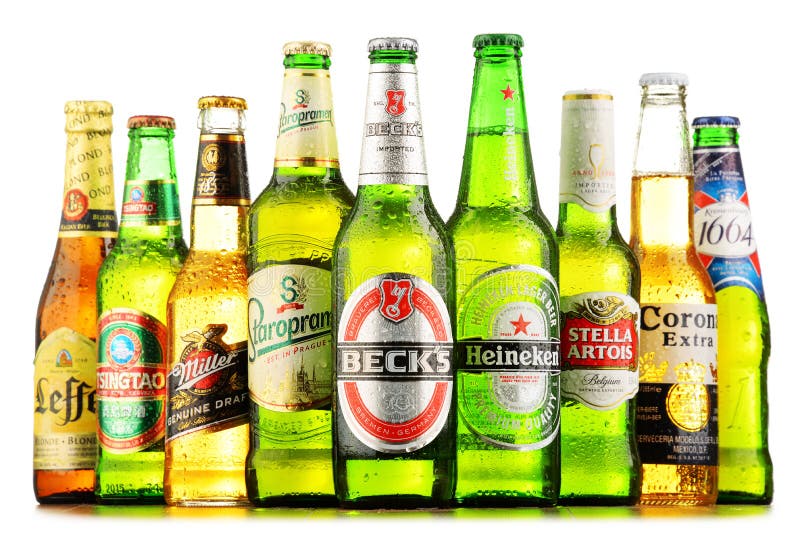
This screenshot has width=800, height=534. I want to click on bottles of beer, so click(66, 481), click(130, 481), click(202, 477), click(286, 482), click(400, 486), click(514, 482), click(596, 476), click(668, 484), click(754, 475).